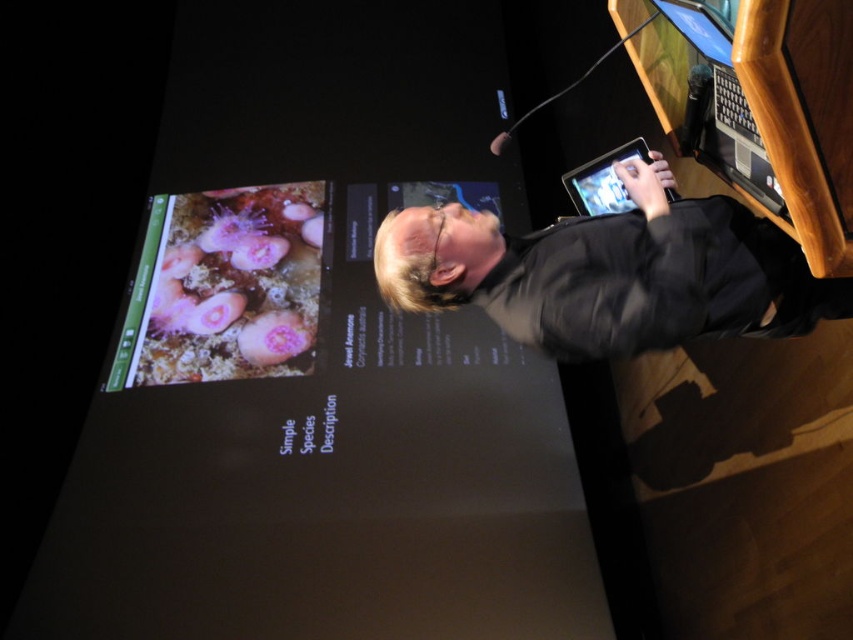
Which of these two, black matte shirt at center or black plastic laptop at upper right, stands taller?

Standing taller between the two is black plastic laptop at upper right.

Is point (497, 316) more distant than point (659, 100)?

No, it is in front of (659, 100).

Find the location of a particular element. black matte shirt at center is located at coordinates (610, 273).